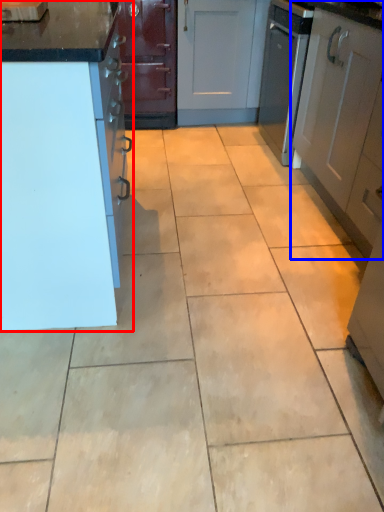
Question: Which of the following is the closest to the observer, cabinetry (highlighted by a red box) or cabinetry (highlighted by a blue box)?

Choices:
 (A) cabinetry
 (B) cabinetry

Answer: (A)